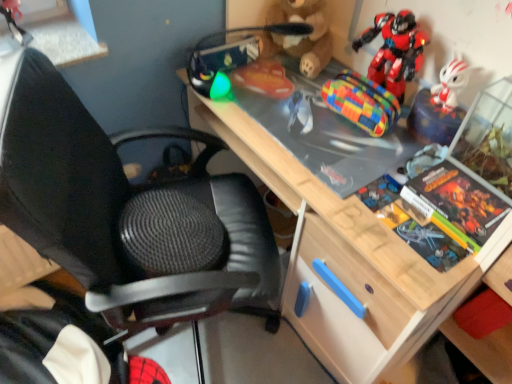
The height and width of the screenshot is (384, 512). Find the location of `free space to the left of multicolored woven pouch at center, placed as the third toy when sorted from left to right`. free space to the left of multicolored woven pouch at center, placed as the third toy when sorted from left to right is located at coordinates (300, 117).